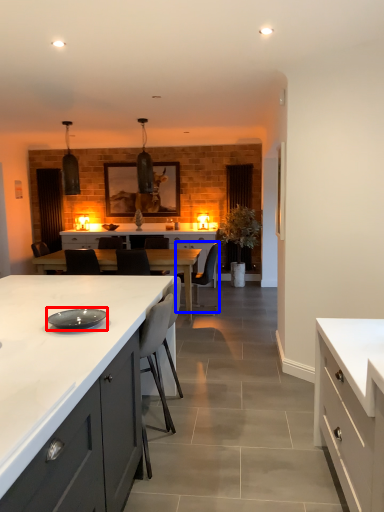
Question: Which object appears closest to the camera in this image, plate (highlighted by a red box) or armchair (highlighted by a blue box)?

Choices:
 (A) plate
 (B) armchair

Answer: (A)